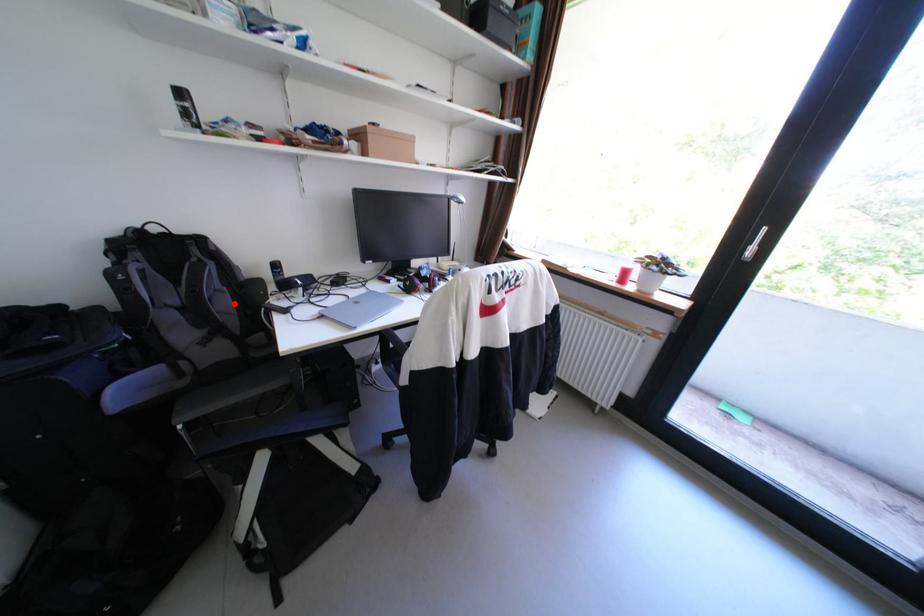
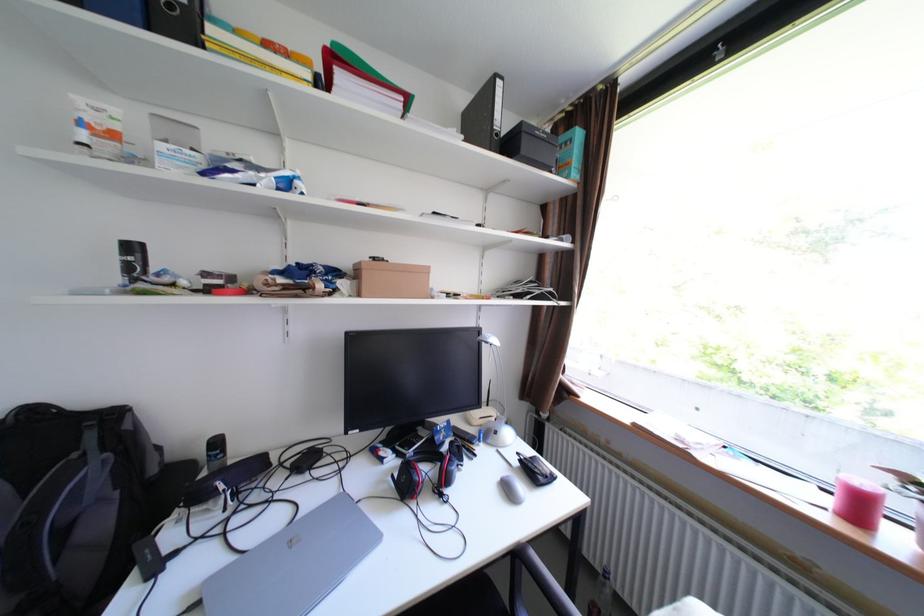
In the second image, find the point that corresponds to the highlighted location in the first image.

(110, 524)